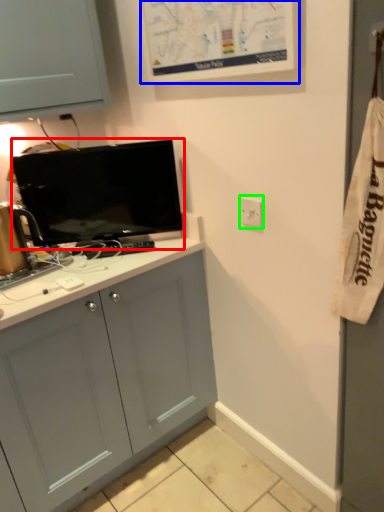
Question: Based on their relative distances, which object is nearer to television (highlighted by a red box)? Choose from bulletin board (highlighted by a blue box) and electric outlet (highlighted by a green box).

Choices:
 (A) bulletin board
 (B) electric outlet

Answer: (A)